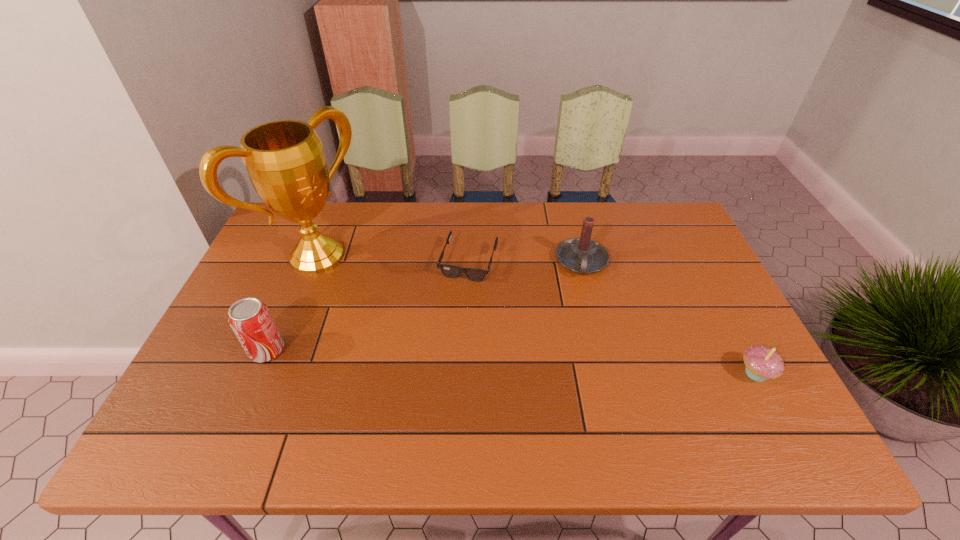
At what (x,y) coordinates should I click in order to perform the action: click on sunglasses located at the far edge. Please return your answer as a coordinate pair (x, y). The width and height of the screenshot is (960, 540). Looking at the image, I should click on tap(450, 271).

At what (x,y) coordinates should I click in order to perform the action: click on object present at the near edge. Please return your answer as a coordinate pair (x, y). This screenshot has height=540, width=960. Looking at the image, I should click on (762, 363).

Where is `soda can that is at the left edge`? Image resolution: width=960 pixels, height=540 pixels. soda can that is at the left edge is located at coordinates pyautogui.click(x=250, y=319).

Find the location of `award present at the left edge`. award present at the left edge is located at coordinates (284, 159).

You are a GUI agent. You are given a task and a screenshot of the screen. Output one action in this format:
    pyautogui.click(x=<x>, y=<y>)
    Task: Click on the object present at the right edge
    The width and height of the screenshot is (960, 540).
    Given the screenshot: What is the action you would take?
    pyautogui.click(x=762, y=363)

Locate an element on the screen. Image resolution: width=960 pixels, height=540 pixels. object that is at the far left corner is located at coordinates (284, 159).

This screenshot has width=960, height=540. Identify the location of object that is at the near right corner. (762, 363).

You are a GUI agent. You are given a task and a screenshot of the screen. Output one action in this format:
    pyautogui.click(x=<x>, y=<y>)
    Task: Click on the vacant area at the far edge of the desktop
    Image resolution: width=960 pixels, height=540 pixels.
    Given the screenshot: What is the action you would take?
    pos(428,244)

Find the location of a particular element. Image resolution: width=960 pixels, height=540 pixels. vacant space at the near edge is located at coordinates coord(503,409).

At what (x,y) coordinates should I click in order to perform the action: click on vacant point at the right edge. Please return your answer as a coordinate pair (x, y). Looking at the image, I should click on (709, 361).